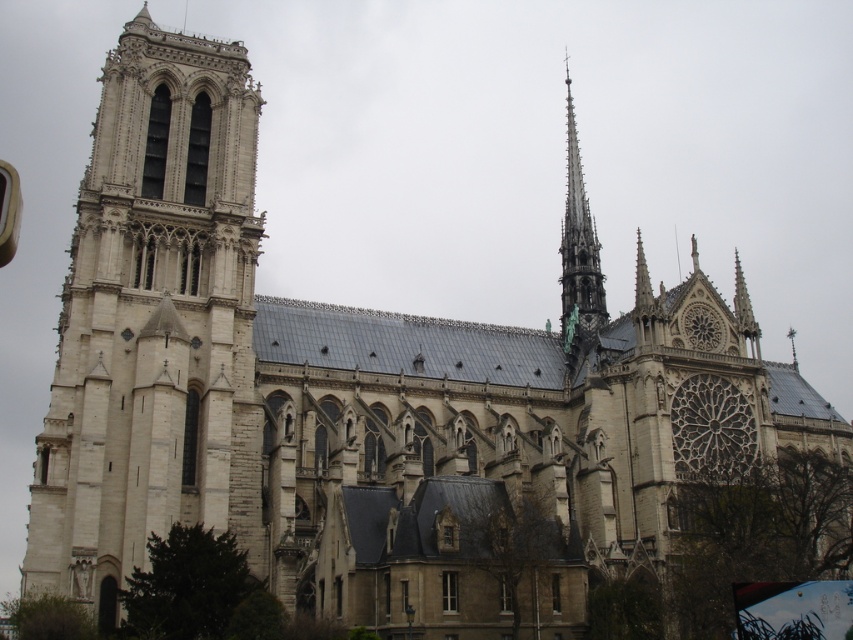
You are a drone operator tasked with capturing aerial footage of the cathedral. Your drone has a maximum flight range of 130 feet. If you are positioned at the base of the white stone tower at left, can you fly your drone to the smooth gray spire at upper right without exceeding its range?

The distance between the white stone tower at left and the smooth gray spire at upper right is 133.75 feet, which exceeds the drone operator maximum flight range of 130 feet. Therefore, the drone cannot reach the smooth gray spire at upper right without exceeding its range.

In the scene shown: You are standing in front of the grand Gothic cathedral. You want to locate the white stone tower at left. Where should you look?

You should look at point (154,323) to locate the white stone tower at left.

You are standing in front of the cathedral and notice two points marked on the structure. The first point is at coordinate point [83,380] and the second is at point [592,241]. Which point is closer to your current position?

Point [83,380] is closer to the camera than point [592,241], so the first point is closer to your current position.